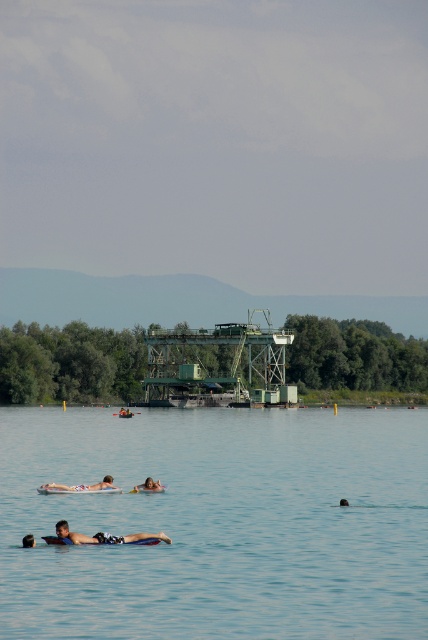
Question: Which object is positioned closest to the smooth skin person at lower center?

Choices:
 (A) dark brown hair at lower center
 (B) clear blue water at center
 (C) light blue fabric float at lower center
 (D) matte black swim trunks at center

Answer: (D)

Question: Which point is closer to the camera?

Choices:
 (A) light blue fabric float at lower center
 (B) matte black swim trunks at center

Answer: (B)

Question: Is matte black swim trunks at center below light blue fabric float at lower center?

Choices:
 (A) no
 (B) yes

Answer: (A)

Question: Is smooth skin person at lower center closer to the viewer compared to smooth orange kayak at center?

Choices:
 (A) yes
 (B) no

Answer: (A)

Question: Is the position of smooth skin person at lower center less distant than that of dark brown hair at lower center?

Choices:
 (A) yes
 (B) no

Answer: (A)

Question: Among these objects, which one is nearest to the camera?

Choices:
 (A) matte black swim trunks at center
 (B) light blue fabric float at lower center
 (C) smooth skin person at lower center

Answer: (A)